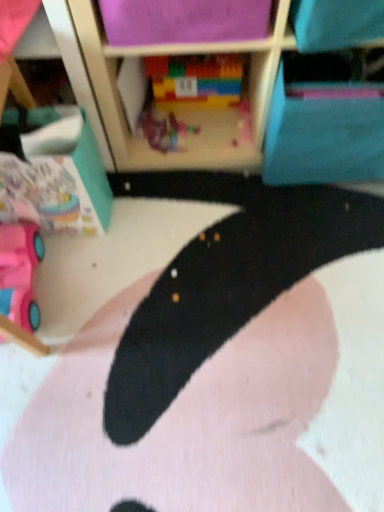
At what (x,y) coordinates should I click in order to perform the action: click on space that is in front of pink plastic toy car at lower left, the 3th toy when ordered from right to left. Please return your answer as a coordinate pair (x, y). This screenshot has height=512, width=384. Looking at the image, I should click on (43, 375).